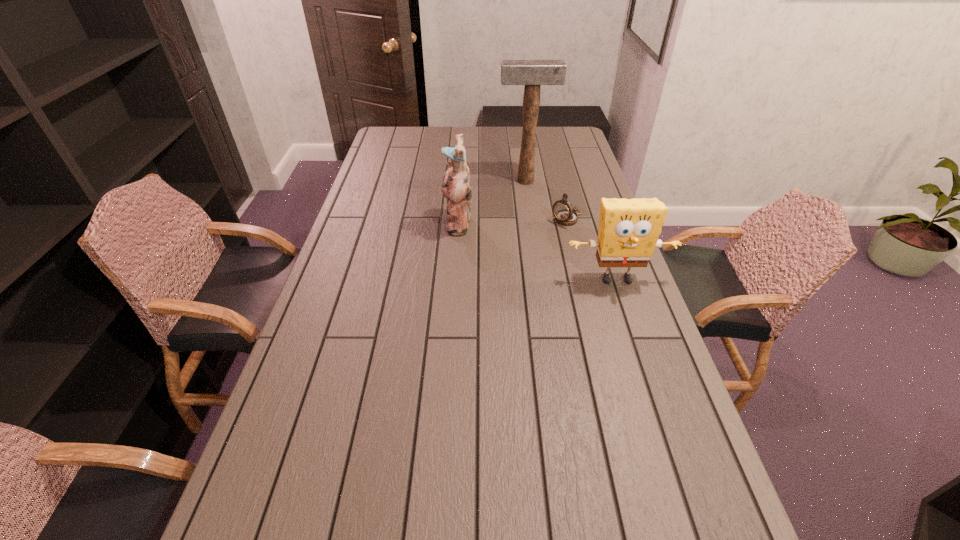
The height and width of the screenshot is (540, 960). I want to click on the leftmost object, so click(x=455, y=187).

Image resolution: width=960 pixels, height=540 pixels. I want to click on figurine, so click(455, 187).

This screenshot has height=540, width=960. In order to click on sponge in this screenshot , I will do `click(628, 232)`.

The height and width of the screenshot is (540, 960). I want to click on the nearest object, so click(628, 232).

Find the location of a particular element. The height and width of the screenshot is (540, 960). the tallest object is located at coordinates (532, 73).

Locate an element on the screen. mallet is located at coordinates (532, 73).

Identify the location of the shortest object. (564, 214).

Image resolution: width=960 pixels, height=540 pixels. In order to click on free space located on the front-facing side of the third shortest object in this screenshot , I will do `click(401, 224)`.

Identify the location of blank area located 0.310m on the front-facing side of the third shortest object. (355, 224).

Where is `free location located on the front-facing side of the third shortest object`? The height and width of the screenshot is (540, 960). free location located on the front-facing side of the third shortest object is located at coordinates (352, 224).